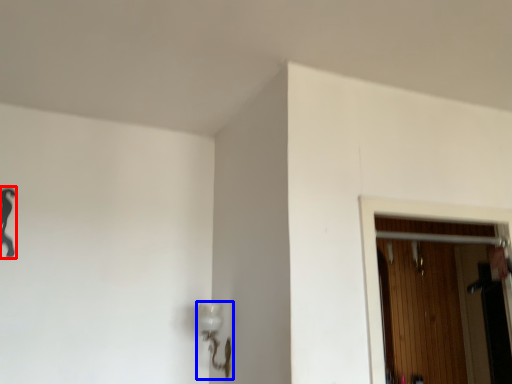
Question: Which point is closer to the camera, woman (highlighted by a red box) or lamp (highlighted by a blue box)?

Choices:
 (A) woman
 (B) lamp

Answer: (A)